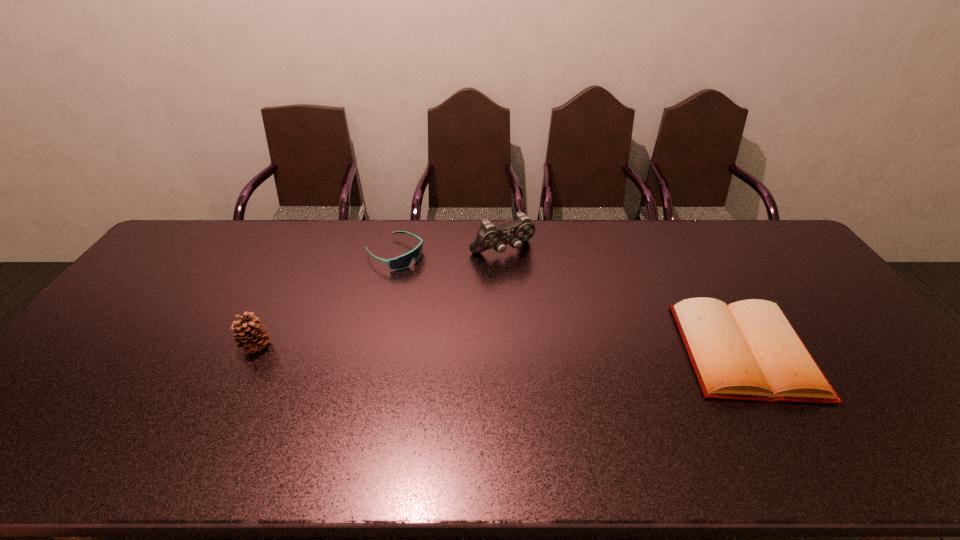
Locate an element on the screen. The image size is (960, 540). the leftmost object is located at coordinates (247, 333).

Locate an element on the screen. This screenshot has height=540, width=960. Bible is located at coordinates (748, 350).

You are a GUI agent. You are given a task and a screenshot of the screen. Output one action in this format:
    pyautogui.click(x=<x>, y=<y>)
    Task: Click on the shortest object
    The height and width of the screenshot is (540, 960).
    Given the screenshot: What is the action you would take?
    pyautogui.click(x=748, y=350)

The image size is (960, 540). I want to click on control, so click(489, 236).

Locate an element on the screen. sunglasses is located at coordinates (403, 261).

Identify the location of the third object from right to left. (403, 261).

Locate an element on the screen. This screenshot has height=540, width=960. free space located 0.330m on the back of the leftmost object is located at coordinates (299, 260).

I want to click on free location located 0.130m on the back of the Bible, so click(x=703, y=278).

This screenshot has height=540, width=960. Identify the location of free region located on the surface of the second object from right to left with buttons. (571, 343).

Where is `vacant space situated on the surface of the second object from right to left with buttons`? This screenshot has width=960, height=540. vacant space situated on the surface of the second object from right to left with buttons is located at coordinates (525, 278).